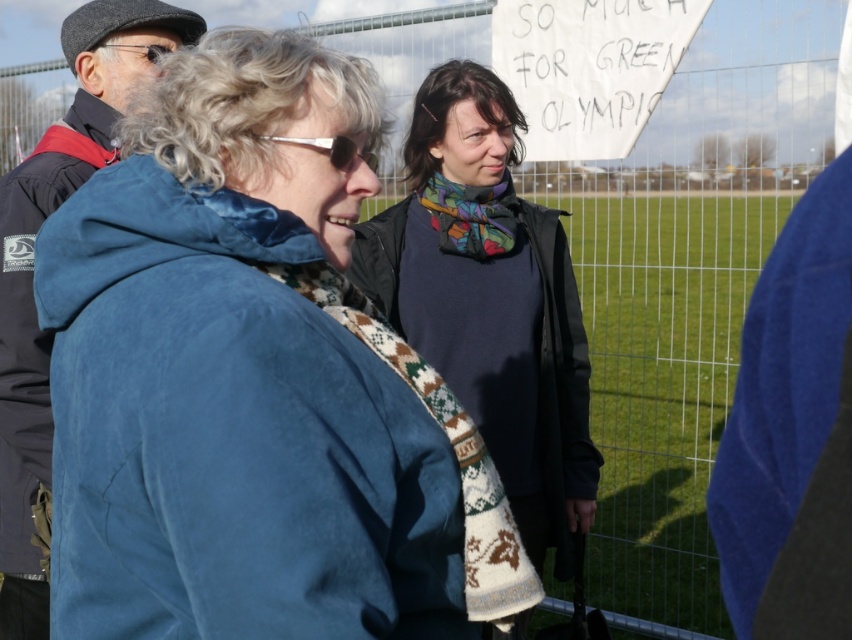
Question: Does dark blue sweater at center have a lesser width compared to green grass at center?

Choices:
 (A) yes
 (B) no

Answer: (B)

Question: Which point is farther from the camera taking this photo?

Choices:
 (A) (403, 252)
 (B) (142, 160)
 (C) (602, 483)
 (D) (38, 577)

Answer: (C)

Question: Can you confirm if dark blue sweater at center is positioned to the left of green grass at center?

Choices:
 (A) yes
 (B) no

Answer: (A)

Question: Which object appears farthest from the camera in this image?

Choices:
 (A) dark blue sweater at center
 (B) blue suede jacket at center
 (C) green grass at center
 (D) velvet blue jacket at left

Answer: (C)

Question: Does dark blue sweater at center appear on the right side of velvet blue jacket at left?

Choices:
 (A) yes
 (B) no

Answer: (A)

Question: Which object is farther from the camera taking this photo?

Choices:
 (A) green grass at center
 (B) dark blue sweater at center

Answer: (A)